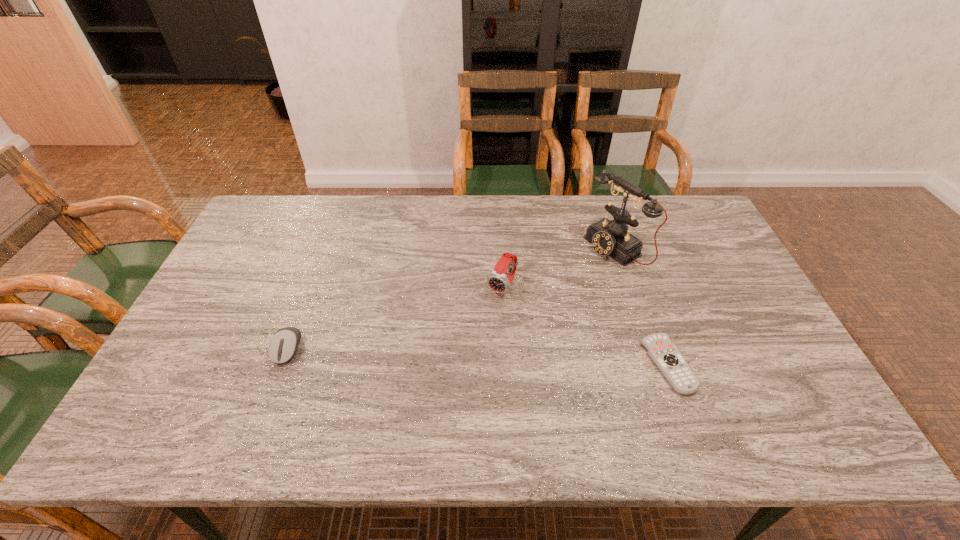
Identify the location of object that is the third closest to the tallest object. This screenshot has height=540, width=960. (283, 346).

Identify which object is the third closest to the leftmost object. Please provide its 2D coordinates. Your answer should be formatted as a tuple, i.e. [(x, y)], where the tuple contains the x and y coordinates of a point satisfying the conditions above.

[(666, 356)]

You are a GUI agent. You are given a task and a screenshot of the screen. Output one action in this format:
    pyautogui.click(x=<x>, y=<y>)
    Task: Click on the vacant area that satisfies the following two spatial constraints: 1. on the front side of the watch; 2. on the right side of the remote control
    This screenshot has height=540, width=960.
    Given the screenshot: What is the action you would take?
    pyautogui.click(x=506, y=364)

In order to click on vacant point that satisfies the following two spatial constraints: 1. on the front side of the remote control; 2. on the left side of the second tallest object in this screenshot , I will do `click(506, 364)`.

This screenshot has width=960, height=540. Identify the location of vacant region that satisfies the following two spatial constraints: 1. on the wheel side of the third tallest object; 2. on the right side of the remote control. (281, 364).